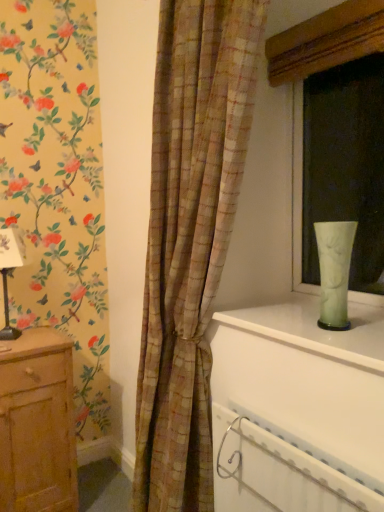
Locate an element on the screen. This screenshot has height=512, width=384. free space on the front side of green glass vase at upper right is located at coordinates (345, 347).